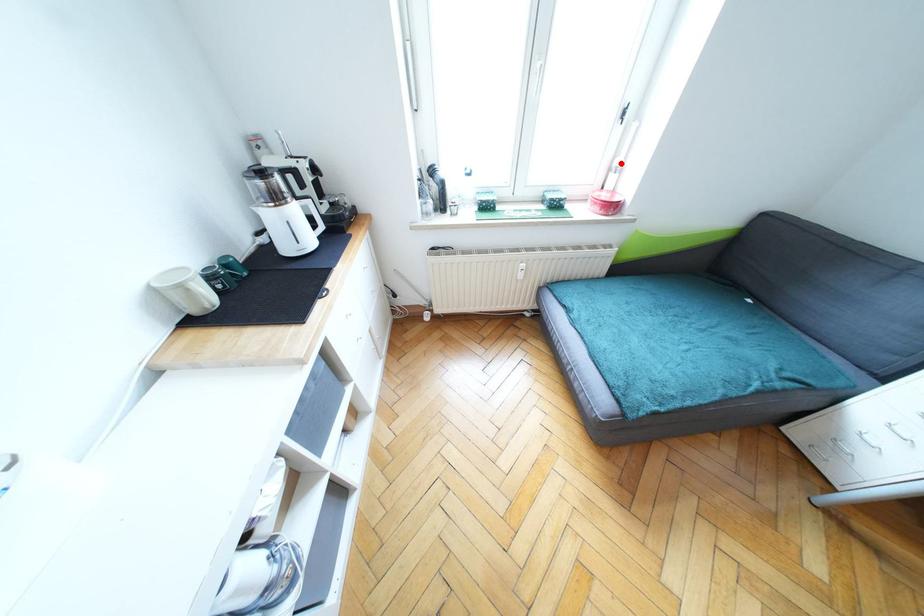
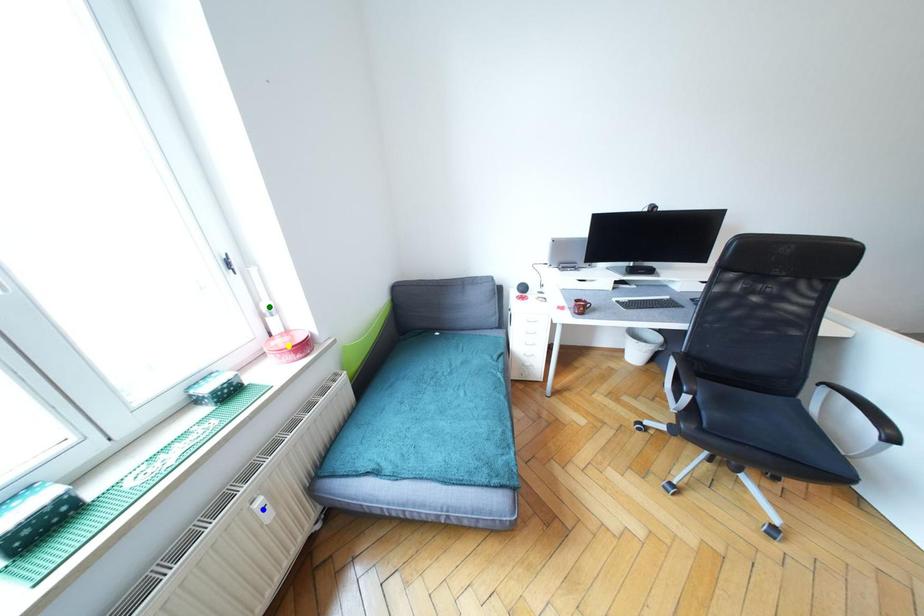
Question: I am providing you with two images of the same scene from different viewpoints. A red point is marked on the first image. You are given multiple points on the second image. Which point in image 2 represents the same 3d spot as the red point in image 1?

Choices:
 (A) yellow point
 (B) green point
 (C) blue point

Answer: (B)